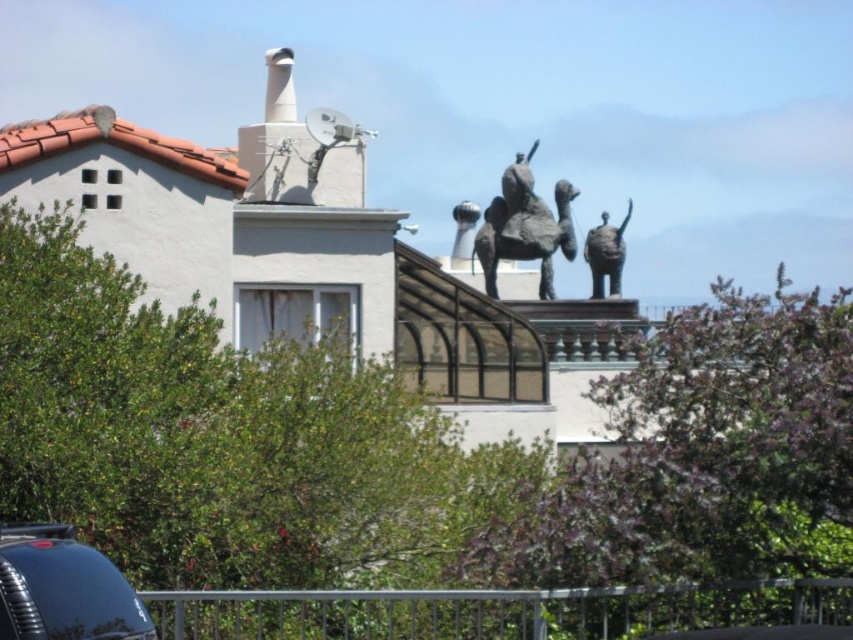
Based on the photo, is bronze statue at upper center below bronze statue at upper right?

Incorrect, bronze statue at upper center is not positioned below bronze statue at upper right.

Looking at this image, can you confirm if bronze statue at upper center is shorter than bronze statue at upper right?

No.

The image size is (853, 640). Describe the element at coordinates (524, 227) in the screenshot. I see `bronze statue at upper center` at that location.

Identify the location of bronze statue at upper center. 524,227.

Who is more forward, (560, 625) or (289, 74)?

Point (560, 625)

This screenshot has width=853, height=640. What do you see at coordinates (496, 611) in the screenshot?
I see `silver metallic rail at lower center` at bounding box center [496, 611].

You are a GUI agent. You are given a task and a screenshot of the screen. Output one action in this format:
    pyautogui.click(x=<x>, y=<y>)
    Task: Click on the silver metallic rail at lower center
    This screenshot has width=853, height=640.
    Given the screenshot: What is the action you would take?
    pyautogui.click(x=496, y=611)

The image size is (853, 640). I want to click on silver metallic rail at lower center, so click(x=496, y=611).

Does bronze statue at upper center appear on the left side of white glossy chimney at upper center?

Incorrect, bronze statue at upper center is not on the left side of white glossy chimney at upper center.

Is bronze statue at upper center behind white glossy chimney at upper center?

No, it is not.

Is point (512, 248) positioned after point (289, 92)?

That is False.

What are the coordinates of `bronze statue at upper center` in the screenshot? It's located at (524, 227).